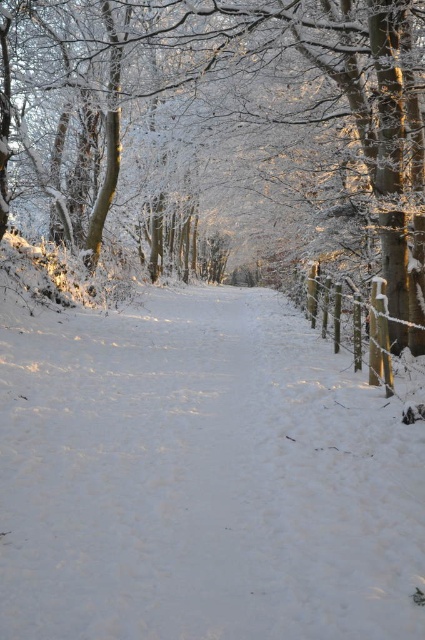
You are a hiker planning to walk along the snow path in the winter scene. You see the white snow at center and the wooden fence at right. Which object is located to the left of the other?

The white snow at center is positioned on the left side of wooden fence at right.

You are an explorer trying to cross the snow path in the winter scene. You notice the white snow at center and the wooden fence at right. Which one is wider in terms of their horizontal span?

The white snow at center is wider than the wooden fence at right in terms of their horizontal span.

Looking at this image, you are a hiker trying to follow the path in the winter scene. You see the white snow at center and the white frosty tree at center. Which one is positioned to the right of the other?

The white snow at center is to the right of the white frosty tree at center.